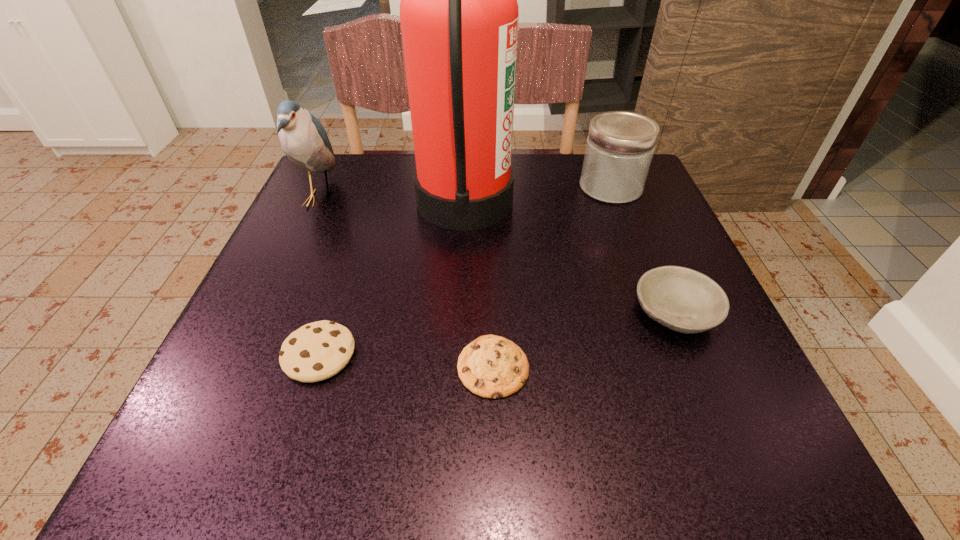
Locate an element on the screen. The image size is (960, 540). the tallest object is located at coordinates (459, 15).

At what (x,y) coordinates should I click in order to perform the action: click on bird. Please return your answer as a coordinate pair (x, y). Looking at the image, I should click on (304, 140).

The image size is (960, 540). I want to click on the second tallest object, so click(304, 140).

What are the coordinates of `jar` in the screenshot? It's located at (620, 145).

Image resolution: width=960 pixels, height=540 pixels. What are the coordinates of `bowl` in the screenshot? It's located at (684, 300).

At what (x,y) coordinates should I click in order to perform the action: click on the left cookie. Please return your answer as a coordinate pair (x, y). Looking at the image, I should click on (316, 351).

You are a GUI agent. You are given a task and a screenshot of the screen. Output one action in this format:
    pyautogui.click(x=<x>, y=<y>)
    Task: Click on the fifth object from right to left
    The image size is (960, 540).
    Given the screenshot: What is the action you would take?
    (316, 351)

Where is `the shorter cookie`? This screenshot has width=960, height=540. the shorter cookie is located at coordinates (491, 366).

Identify the location of the shortest object. (491, 366).

Where is `vacant space located 0.110m at the nozzle of the fire extinguisher`? The height and width of the screenshot is (540, 960). vacant space located 0.110m at the nozzle of the fire extinguisher is located at coordinates (561, 200).